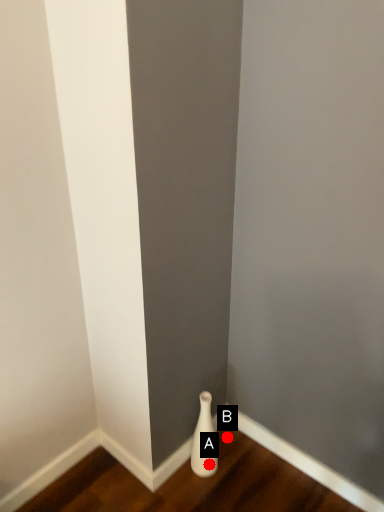
Question: Two points are circled on the image, labeled by A and B beside each circle. Among these points, which one is farthest from the camera?

Choices:
 (A) A is further
 (B) B is further

Answer: (B)